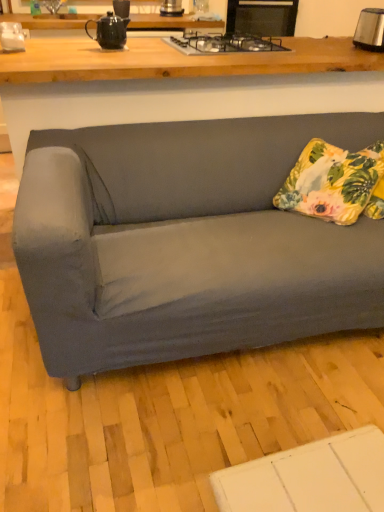
Question: Is floral fabric pillow at right surrounded by matte black teapot at upper center?

Choices:
 (A) yes
 (B) no

Answer: (B)

Question: Does matte black teapot at upper center lie in front of floral fabric pillow at right?

Choices:
 (A) yes
 (B) no

Answer: (B)

Question: From a real-world perspective, is matte black teapot at upper center on floral fabric pillow at right?

Choices:
 (A) no
 (B) yes

Answer: (B)

Question: Can you confirm if matte black teapot at upper center is taller than floral fabric pillow at right?

Choices:
 (A) no
 (B) yes

Answer: (A)

Question: Considering the relative sizes of matte black teapot at upper center and floral fabric pillow at right in the image provided, is matte black teapot at upper center smaller than floral fabric pillow at right?

Choices:
 (A) yes
 (B) no

Answer: (A)

Question: From the image's perspective, is matte wood desk at upper center positioned above or below matte black teapot at upper center?

Choices:
 (A) above
 (B) below

Answer: (B)

Question: Is matte wood desk at upper center wider or thinner than matte black teapot at upper center?

Choices:
 (A) wide
 (B) thin

Answer: (A)

Question: From their relative heights in the image, would you say matte wood desk at upper center is taller or shorter than matte black teapot at upper center?

Choices:
 (A) short
 (B) tall

Answer: (B)

Question: From a real-world perspective, relative to matte black teapot at upper center, is matte wood desk at upper center vertically above or below?

Choices:
 (A) above
 (B) below

Answer: (B)

Question: Is point (97, 22) closer or farther from the camera than point (365, 23)?

Choices:
 (A) closer
 (B) farther

Answer: (A)

Question: From the image's perspective, is matte black teapot at upper center positioned above or below satin silver toaster at upper right?

Choices:
 (A) below
 (B) above

Answer: (A)

Question: Considering the relative positions of matte black teapot at upper center and satin silver toaster at upper right in the image provided, is matte black teapot at upper center to the left or to the right of satin silver toaster at upper right?

Choices:
 (A) right
 (B) left

Answer: (B)

Question: Which is correct: matte black teapot at upper center is inside satin silver toaster at upper right, or outside of it?

Choices:
 (A) outside
 (B) inside

Answer: (A)

Question: In terms of height, does satin silver toaster at upper right look taller or shorter compared to metallic silver toaster at upper center, placed as the second appliance when sorted from left to right?

Choices:
 (A) tall
 (B) short

Answer: (A)

Question: Relative to metallic silver toaster at upper center, placed as the second appliance when sorted from left to right, is satin silver toaster at upper right in front or behind?

Choices:
 (A) behind
 (B) front

Answer: (B)